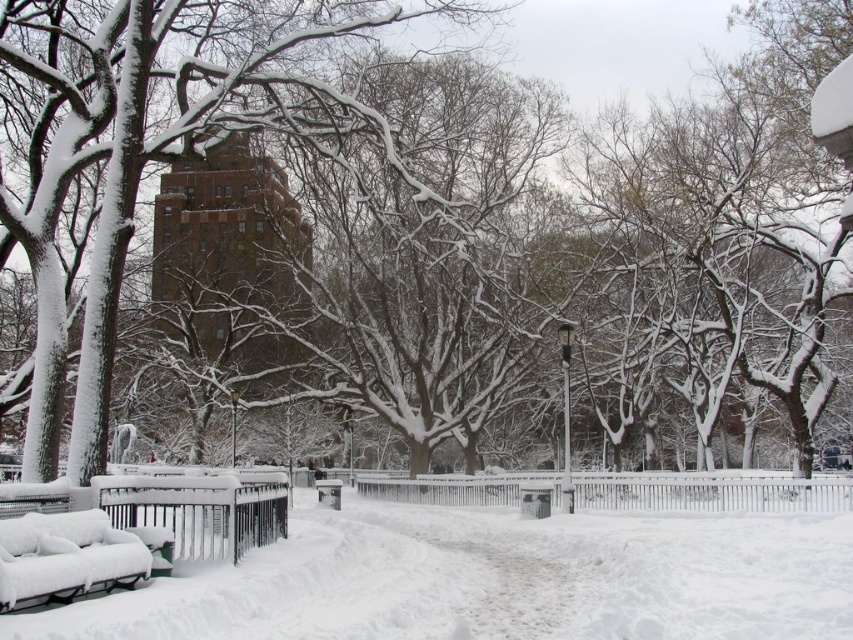
Does white fluffy snow at center lie behind white snow-covered bench at lower left?

No, it is not.

Who is shorter, white fluffy snow at center or white snow-covered bench at lower left?

With less height is white snow-covered bench at lower left.

Between point (117, 621) and point (55, 593), which one is positioned in front?

Point (117, 621) is in front.

The width and height of the screenshot is (853, 640). Identify the location of white fluffy snow at center. (492, 579).